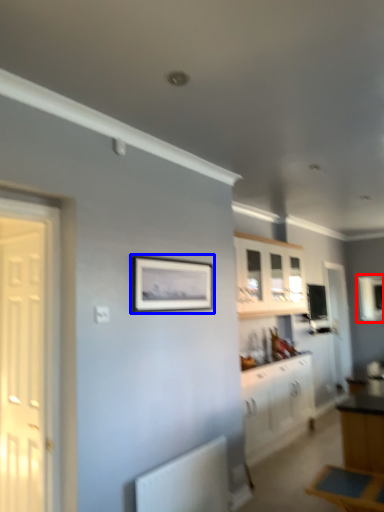
Question: Which object is further to the camera taking this photo, window (highlighted by a red box) or picture frame (highlighted by a blue box)?

Choices:
 (A) window
 (B) picture frame

Answer: (A)